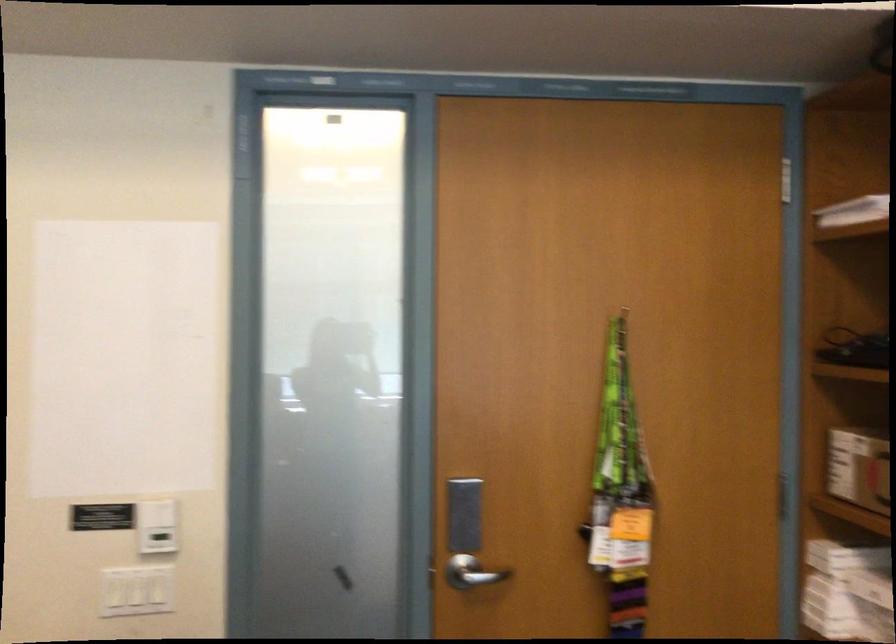
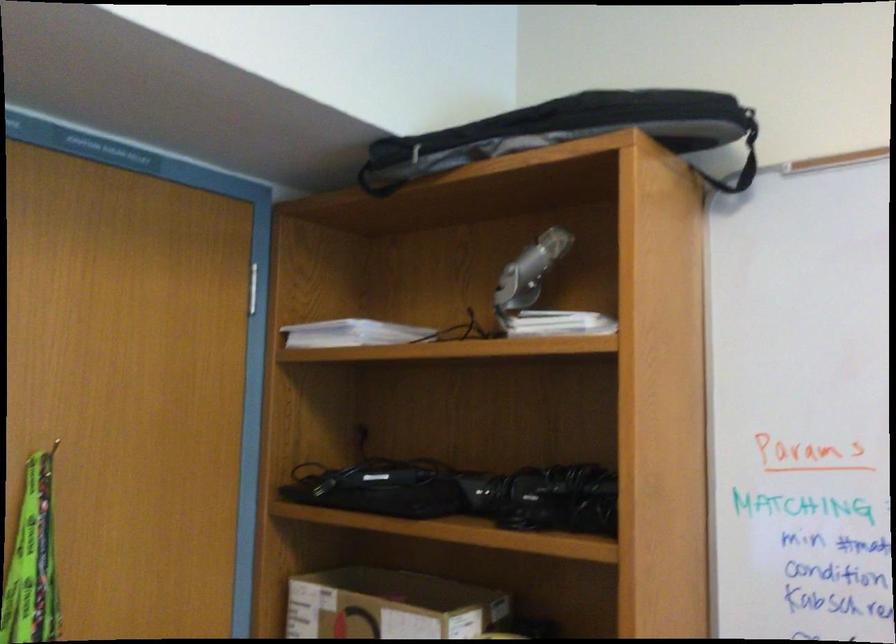
Where in the second image is the point corresponding to (x=619, y=319) from the first image?

(53, 448)